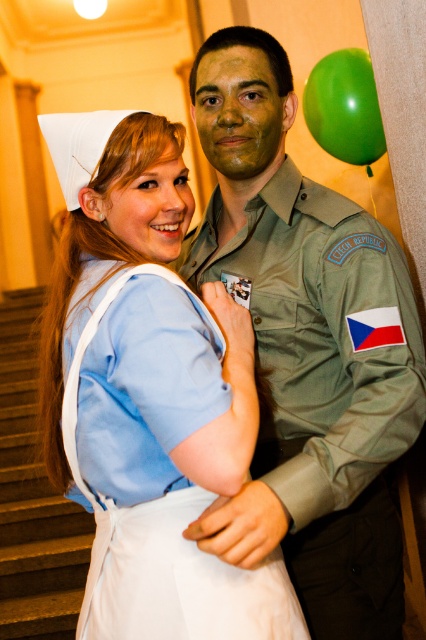
Which is more to the left, light blue fabric nurse uniform at center or green rubber balloon at upper right?

light blue fabric nurse uniform at center is more to the left.

Is light blue fabric nurse uniform at center positioned at the back of green rubber balloon at upper right?

No, light blue fabric nurse uniform at center is closer to the viewer.

Which is in front, point (183, 344) or point (354, 120)?

Positioned in front is point (183, 344).

The width and height of the screenshot is (426, 640). I want to click on light blue fabric nurse uniform at center, so click(147, 392).

Does point (120, 328) lie behind point (353, 316)?

No.

Is point (158, 468) positioned before point (236, 499)?

No.

Describe the element at coordinates (147, 392) in the screenshot. Image resolution: width=426 pixels, height=640 pixels. I see `light blue fabric nurse uniform at center` at that location.

Where is `light blue fabric nurse uniform at center`? light blue fabric nurse uniform at center is located at coordinates (147, 392).

Between matte green uniform at center and green rubber balloon at upper right, which one has more height?

matte green uniform at center

Which is behind, point (330, 474) or point (342, 99)?

Positioned behind is point (342, 99).

The height and width of the screenshot is (640, 426). What are the coordinates of `matte green uniform at center` in the screenshot? It's located at (307, 349).